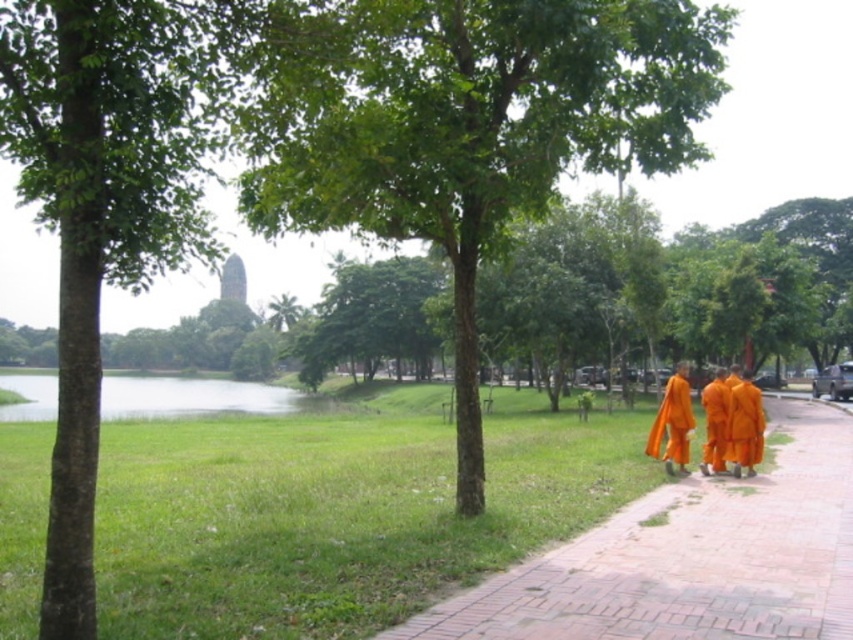
Is point (701, 624) behind point (686, 417)?

No.

Between brick pavement at lower right and orange cloth monk at right, which one has more height?

Standing taller between the two is orange cloth monk at right.

Measure the distance between brick pavement at lower right and camera.

brick pavement at lower right and camera are 5.19 meters apart.

This screenshot has height=640, width=853. I want to click on brick pavement at lower right, so click(689, 557).

Which of these two, green leafy tree at center or brick pavement at lower right, stands taller?

Standing taller between the two is green leafy tree at center.

What are the coordinates of `green leafy tree at center` in the screenshot? It's located at (473, 129).

Where is `green leafy tree at center`? The image size is (853, 640). green leafy tree at center is located at coordinates (473, 129).

Where is `brick pavement at lower right`? The image size is (853, 640). brick pavement at lower right is located at coordinates (689, 557).

Between brick pavement at lower right and orange cloth at lower right, which one has less height?

With less height is brick pavement at lower right.

Who is more distant from viewer, (x=840, y=561) or (x=722, y=419)?

The point (x=722, y=419) is behind.

In order to click on brick pavement at lower right in this screenshot , I will do `click(689, 557)`.